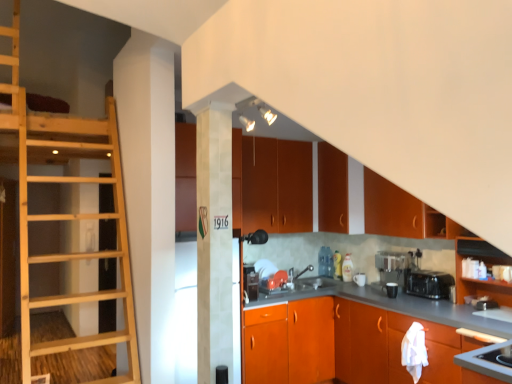
Question: Is matte wood cabinet at upper right, which ranks as the 3th cabinetry in bottom-to-top order, touching metallic silver coffee machine at lower right?

Choices:
 (A) no
 (B) yes

Answer: (A)

Question: From a real-world perspective, is matte wood cabinet at upper right, which ranks as the 3th cabinetry in bottom-to-top order, below metallic silver coffee machine at lower right?

Choices:
 (A) yes
 (B) no

Answer: (B)

Question: From a real-world perspective, is matte wood cabinet at upper right, which ranks as the 3th cabinetry in bottom-to-top order, positioned over metallic silver coffee machine at lower right based on gravity?

Choices:
 (A) no
 (B) yes

Answer: (B)

Question: Is matte wood cabinet at upper right, which ranks as the 3th cabinetry in bottom-to-top order, taller than metallic silver coffee machine at lower right?

Choices:
 (A) no
 (B) yes

Answer: (B)

Question: Is matte wood cabinet at upper right, marked as the 4th cabinetry in a top-to-bottom arrangement, to the left of metallic silver coffee machine at lower right from the viewer's perspective?

Choices:
 (A) yes
 (B) no

Answer: (B)

Question: Is matte wood cabinet at upper right, marked as the 4th cabinetry in a top-to-bottom arrangement, positioned in front of metallic silver coffee machine at lower right?

Choices:
 (A) no
 (B) yes

Answer: (B)

Question: Is matte black coffee maker at lower center, which is the fourth appliance in front-to-back order, facing towards orange matte cabinet at center, the 1th cabinetry ordered from the bottom?

Choices:
 (A) no
 (B) yes

Answer: (A)

Question: Does matte black coffee maker at lower center, positioned as the first appliance in back-to-front order, come behind orange matte cabinet at center, the 6th cabinetry positioned from the top?

Choices:
 (A) yes
 (B) no

Answer: (A)

Question: Does matte black coffee maker at lower center, which is the fourth appliance in front-to-back order, come in front of orange matte cabinet at center, the 6th cabinetry positioned from the top?

Choices:
 (A) no
 (B) yes

Answer: (A)

Question: Considering the relative sizes of matte black coffee maker at lower center, which is the third appliance in right-to-left order, and orange matte cabinet at center, the 1th cabinetry ordered from the bottom, in the image provided, is matte black coffee maker at lower center, which is the third appliance in right-to-left order, smaller than orange matte cabinet at center, the 1th cabinetry ordered from the bottom,?

Choices:
 (A) yes
 (B) no

Answer: (A)

Question: From a real-world perspective, is matte black coffee maker at lower center, positioned as the first appliance in back-to-front order, over orange matte cabinet at center, the 1th cabinetry ordered from the bottom?

Choices:
 (A) no
 (B) yes

Answer: (B)

Question: Is orange matte cabinet at center, the 6th cabinetry positioned from the top, inside matte black coffee maker at lower center, which is the third appliance in right-to-left order?

Choices:
 (A) yes
 (B) no

Answer: (B)

Question: Can you confirm if natural wood ladder at left is bigger than matte black coffee maker at lower center, marked as the second appliance in a left-to-right arrangement?

Choices:
 (A) no
 (B) yes

Answer: (B)